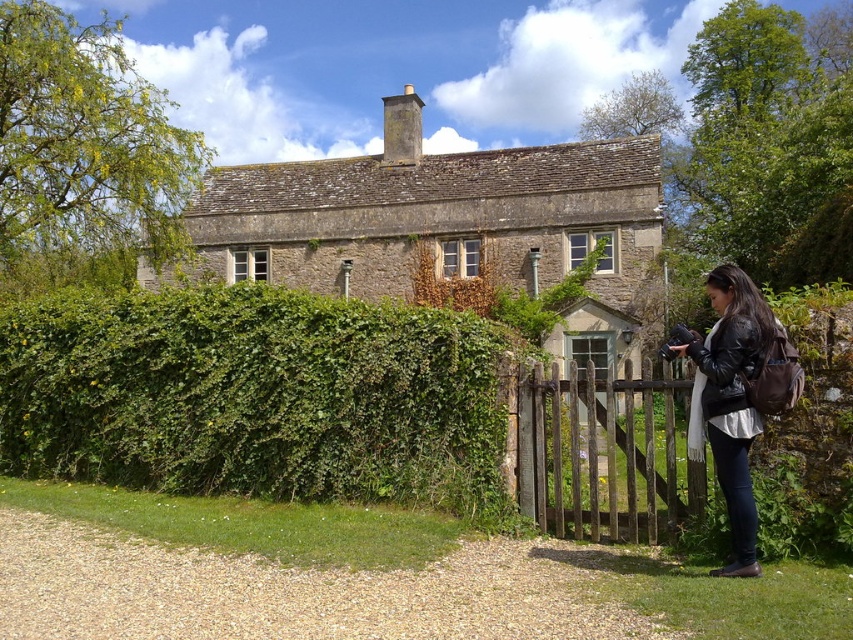
Question: Which point is farther from the camera taking this photo?

Choices:
 (A) (535, 516)
 (B) (1, 413)
 (C) (254, 211)
 (D) (718, 422)

Answer: (C)

Question: Which of the following is the farthest from the observer?

Choices:
 (A) (242, 326)
 (B) (625, 404)
 (C) (387, 172)
 (D) (747, 532)

Answer: (C)

Question: Which object is closer to the camera taking this photo?

Choices:
 (A) green leafy hedge at left
 (B) weathered wood gate at center
 (C) black leather jacket at lower right
 (D) stone cottage at center

Answer: (C)

Question: Is the position of green leafy hedge at left more distant than that of black leather jacket at lower right?

Choices:
 (A) yes
 (B) no

Answer: (A)

Question: Is green leafy hedge at left positioned behind stone cottage at center?

Choices:
 (A) no
 (B) yes

Answer: (A)

Question: Does green leafy hedge at left come behind black leather jacket at lower right?

Choices:
 (A) no
 (B) yes

Answer: (B)